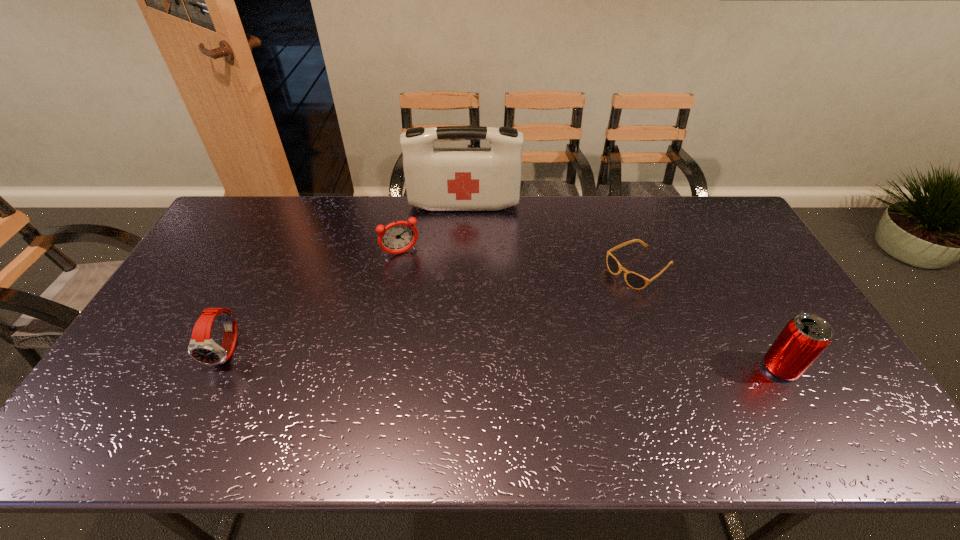
Image resolution: width=960 pixels, height=540 pixels. Identify the location of unoccupied area between the leftmost object and the shortest object. (435, 310).

The height and width of the screenshot is (540, 960). Identify the location of empty location between the farthest object and the soda can. (622, 286).

Find the location of a particular element. The height and width of the screenshot is (540, 960). free spot between the shortest object and the leftmost object is located at coordinates (435, 310).

In order to click on vacant space that is in between the leftmost object and the second tallest object in this screenshot , I will do `click(504, 359)`.

Where is `blank region between the tallest object and the second object from right to left`? blank region between the tallest object and the second object from right to left is located at coordinates (552, 237).

The image size is (960, 540). Find the location of `empty location between the sunglasses and the watch`. empty location between the sunglasses and the watch is located at coordinates (435, 310).

Locate an element on the screen. Image resolution: width=960 pixels, height=540 pixels. vacant area between the alarm clock and the rightmost object is located at coordinates (590, 310).

Find the location of a particular element. unoccupied position between the alarm clock and the soda can is located at coordinates (590, 310).

Select which object appears as the second closest to the watch. Please provide its 2D coordinates. Your answer should be formatted as a tuple, i.e. [(x, y)], where the tuple contains the x and y coordinates of a point satisfying the conditions above.

[(437, 179)]

Select which object appears as the third closest to the first-aid kit. Please provide its 2D coordinates. Your answer should be formatted as a tuple, i.e. [(x, y)], where the tuple contains the x and y coordinates of a point satisfying the conditions above.

[(202, 348)]